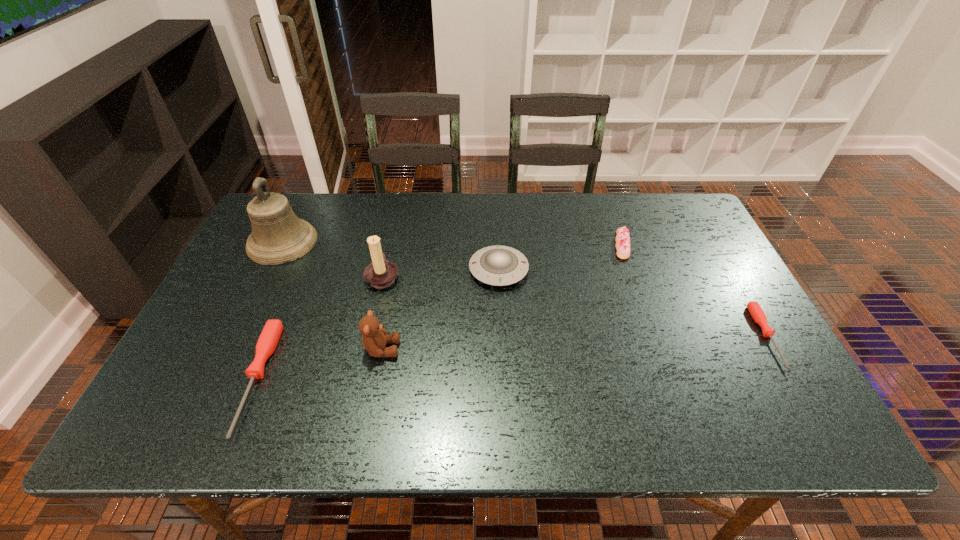
Please point a location where one more screwdriver can be added evenly. Please provide its 2D coordinates. Your answer should be formatted as a tuple, i.e. [(x, y)], where the tuple contains the x and y coordinates of a point satisfying the conditions above.

[(522, 357)]